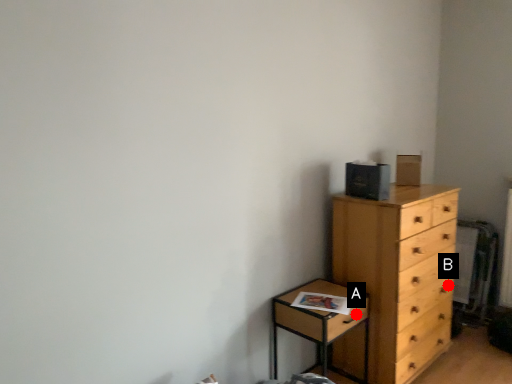
Question: Two points are circled on the image, labeled by A and B beside each circle. Which point is closer to the camera?

Choices:
 (A) A is closer
 (B) B is closer

Answer: (A)